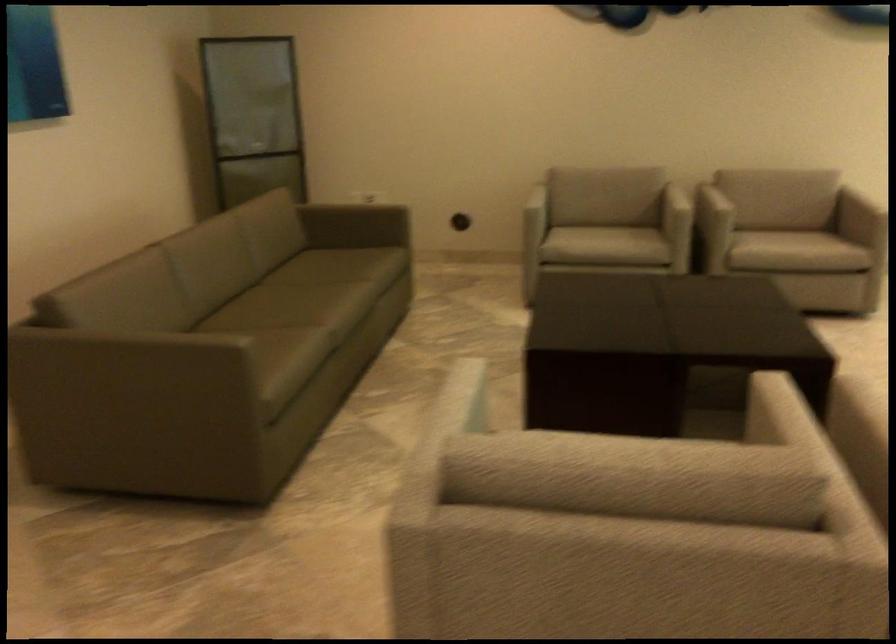
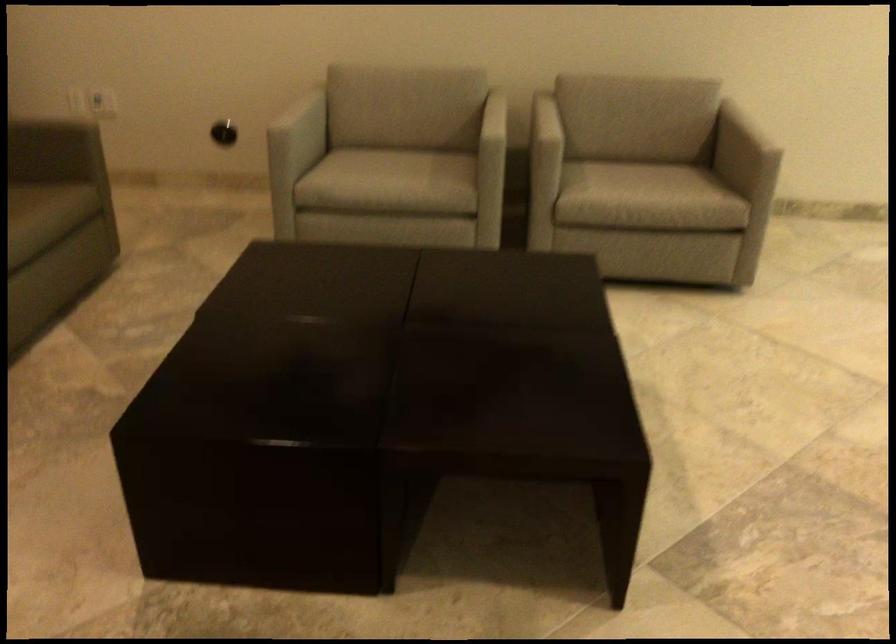
Find the pixel in the second image that matches point (604, 236) in the first image.

(390, 176)